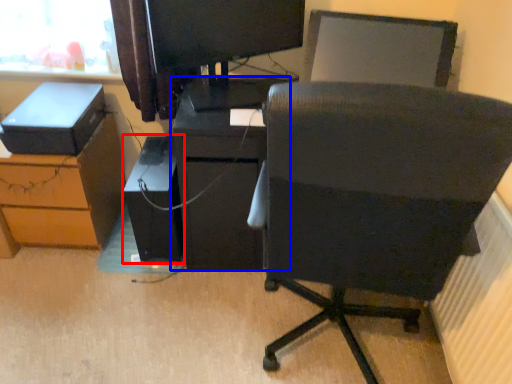
Question: Which point is further to the camera, computer tower (highlighted by a red box) or furniture (highlighted by a blue box)?

Choices:
 (A) computer tower
 (B) furniture

Answer: (A)